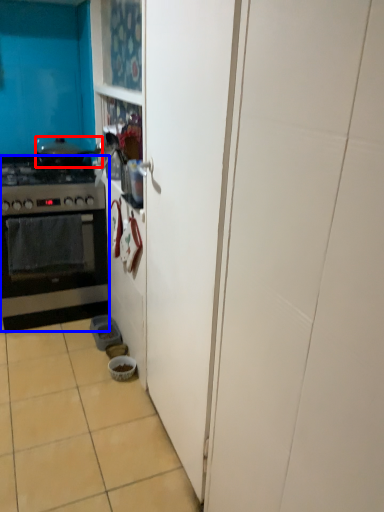
Question: Which point is closer to the camera, pot/pan (highlighted by a red box) or kitchen appliance (highlighted by a blue box)?

Choices:
 (A) pot/pan
 (B) kitchen appliance

Answer: (B)